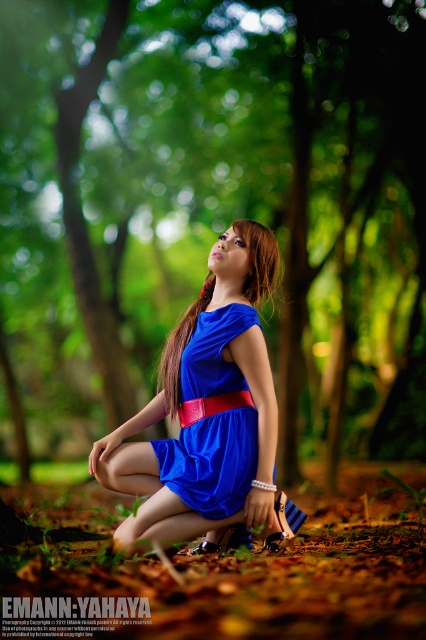
Question: Considering the relative positions of blue matte dress at center and brown smooth hair at center in the image provided, where is blue matte dress at center located with respect to brown smooth hair at center?

Choices:
 (A) below
 (B) above

Answer: (A)

Question: Is blue matte dress at center above brown smooth hair at center?

Choices:
 (A) no
 (B) yes

Answer: (A)

Question: Which object is the farthest from the blue matte dress at center?

Choices:
 (A) brown smooth hair at center
 (B) blue satin dress at center

Answer: (A)

Question: Which of these objects is positioned closest to the blue matte dress at center?

Choices:
 (A) blue satin dress at center
 (B) brown smooth hair at center

Answer: (A)

Question: Which of the following is the closest to the observer?

Choices:
 (A) (224, 288)
 (B) (199, 449)

Answer: (B)

Question: Does blue satin dress at center have a larger size compared to brown smooth hair at center?

Choices:
 (A) no
 (B) yes

Answer: (A)